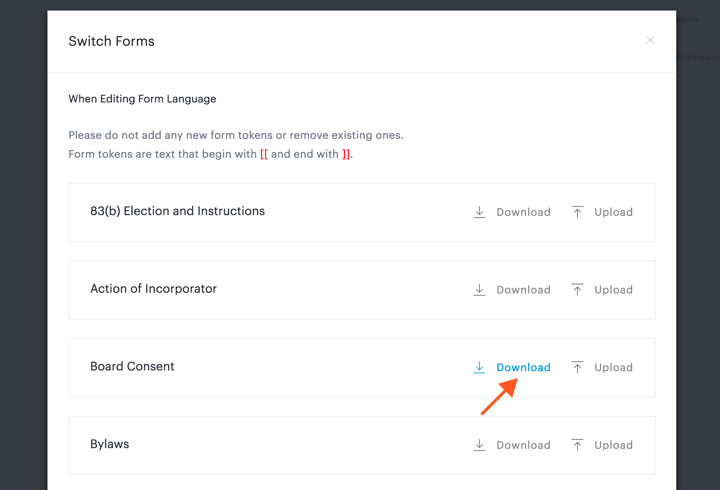
What are the coordinates of `exit button` in the screenshot? It's located at (651, 40).